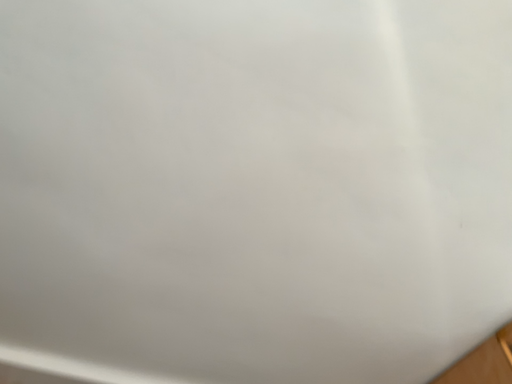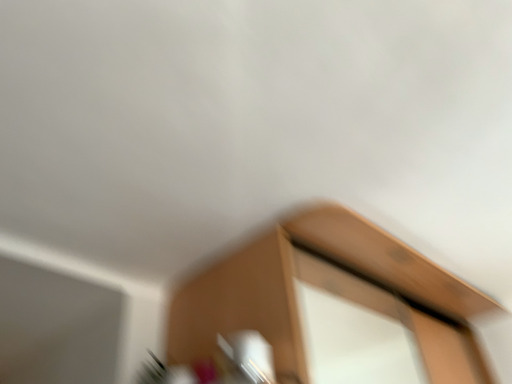
Question: How did the camera likely rotate when shooting the video?

Choices:
 (A) rotated left
 (B) rotated right

Answer: (B)